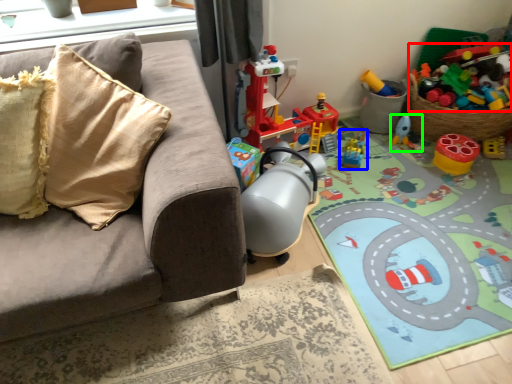
Question: Estimate the real-world distances between objects in this image. Which object is closer to toy (highlighted by a red box), toy (highlighted by a blue box) or toy (highlighted by a green box)?

Choices:
 (A) toy
 (B) toy

Answer: (B)